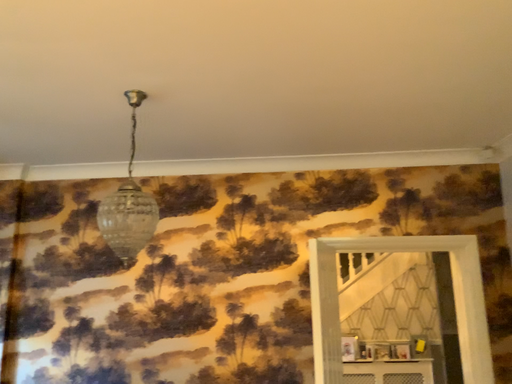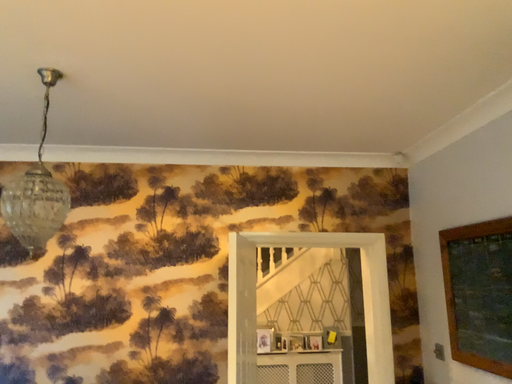
Question: Which way did the camera rotate in the video?

Choices:
 (A) rotated right
 (B) rotated left

Answer: (A)